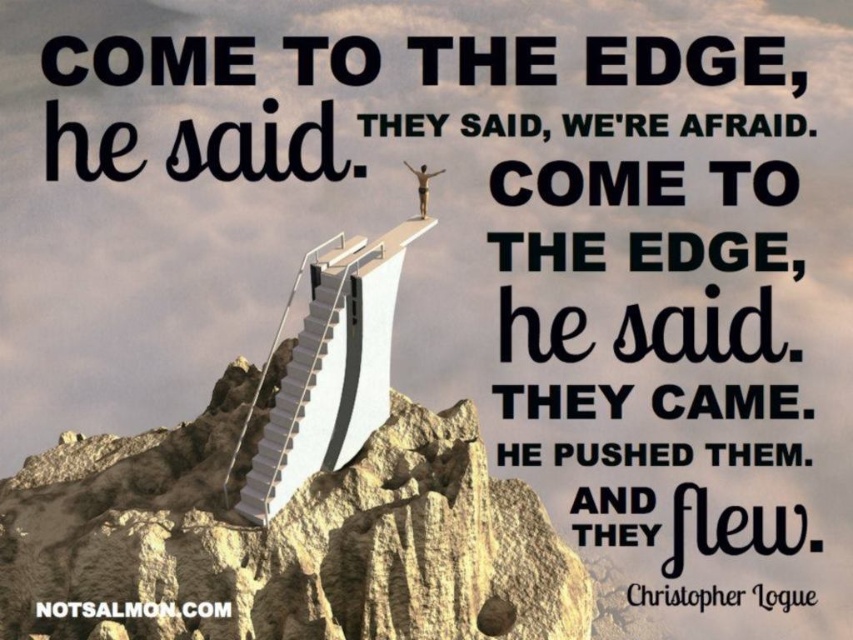
You are standing at the base of the cliff looking up at the staircase and the figure. Which of the two points, point (465,634) or point (318,340), is closer to you?

Point (465,634) is further to the viewer than point (318,340), so the point closer to you is point (318,340).

You are a photographer planning to capture the rugged stone peak at center and the skinny human figure at upper center in a single frame. Based on their sizes, which object would appear larger in the photo?

The rugged stone peak at center would appear larger in the photo because it is wider than the skinny human figure at upper center.

You are a photographer trying to capture the human figure at the top of the stairs. Based on the scene, which object is thinner, the white glossy stairs at center or the skinny human figure at upper center?

The white glossy stairs at center is thinner than the skinny human figure at upper center according to the description.